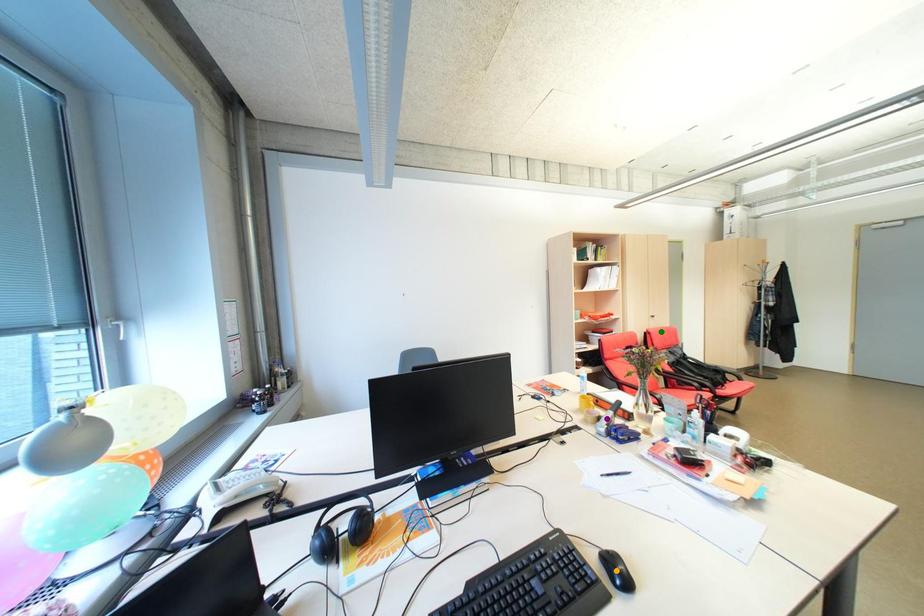
Order these from farthest to nearest:
A) green point
B) purple point
C) orange point

green point
purple point
orange point